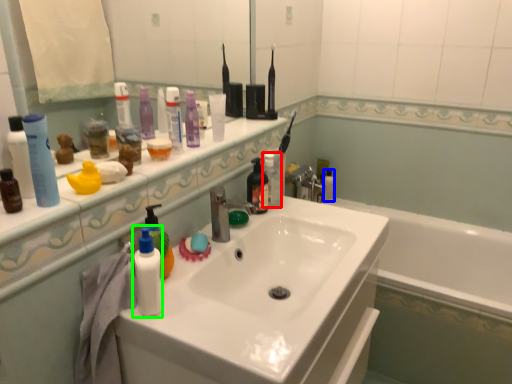
Question: Which is farther away from toiletry (highlighted by a red box)? mouthwash (highlighted by a blue box) or toiletry (highlighted by a green box)?

Choices:
 (A) mouthwash
 (B) toiletry

Answer: (A)